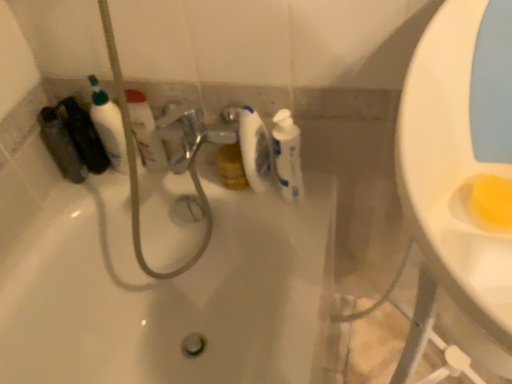
Identify the location of vacant point to the right of translucent plastic mouthwash at left. point(118,167).